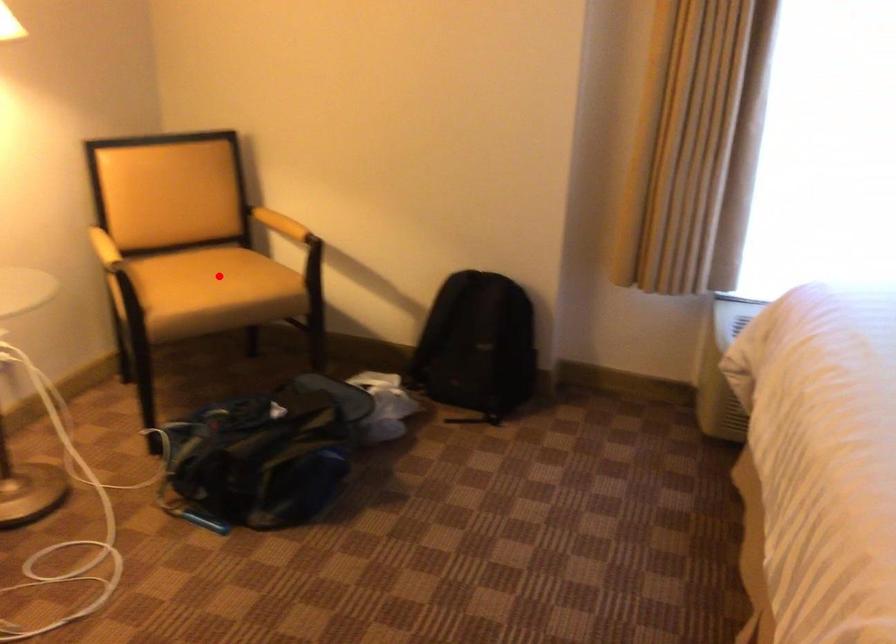
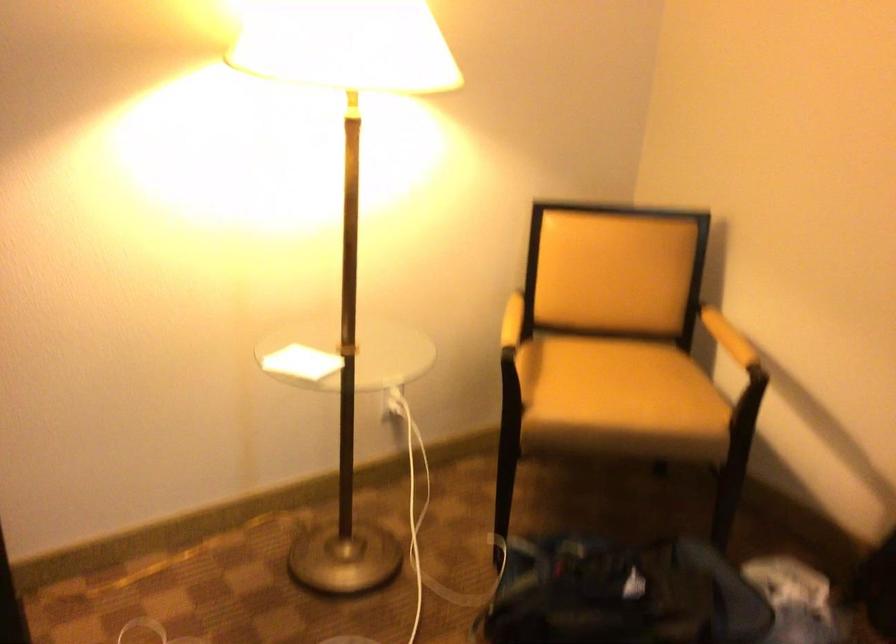
Question: I am providing you with two images of the same scene from different viewpoints. Image1 has a red point marked. In image2, the corresponding 3D location appears at what relative position? Reply with the corresponding letter.

Choices:
 (A) Closer
 (B) Farther

Answer: (A)